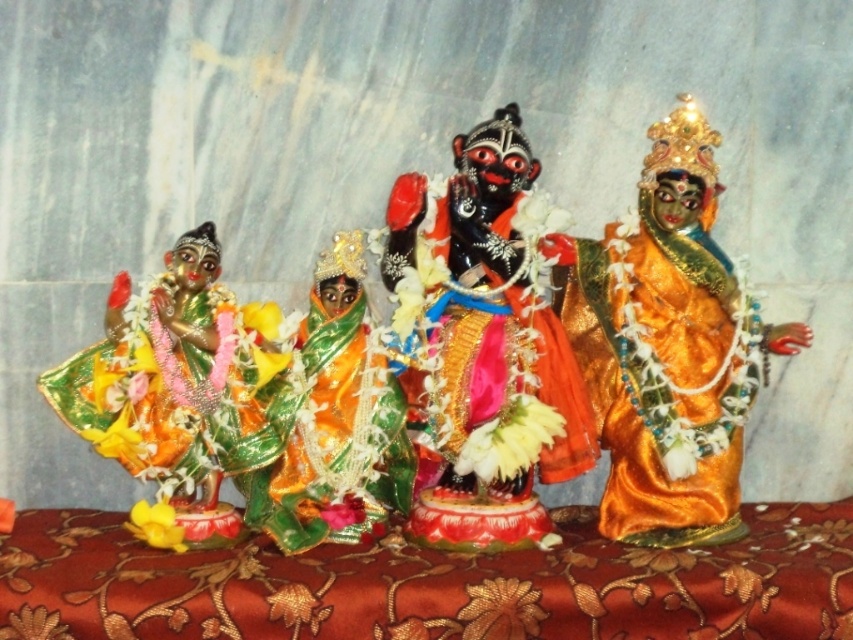
Question: Which is nearer to the green satin/silk sari at center?

Choices:
 (A) silky red cloth at center
 (B) black glossy statue at center
 (C) shiny green fabric at left
 (D) orange satin robe at right

Answer: (C)

Question: Can you confirm if silky red cloth at center is bigger than orange satin robe at right?

Choices:
 (A) yes
 (B) no

Answer: (A)

Question: Among these objects, which one is nearest to the camera?

Choices:
 (A) black glossy statue at center
 (B) green satin/silk sari at center

Answer: (A)

Question: Which of these objects is positioned closest to the black glossy statue at center?

Choices:
 (A) green satin/silk sari at center
 (B) shiny green fabric at left
 (C) orange satin robe at right
 (D) silky red cloth at center

Answer: (C)

Question: Is orange satin robe at right to the right of green satin/silk sari at center from the viewer's perspective?

Choices:
 (A) no
 (B) yes

Answer: (B)

Question: In this image, where is silky red cloth at center located relative to shiny green fabric at left?

Choices:
 (A) below
 (B) above

Answer: (A)